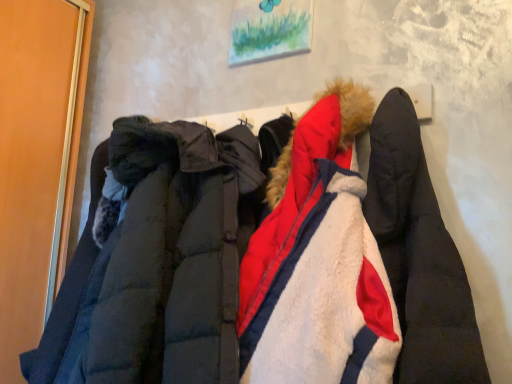
Where is `dark blue puffer jacket at center`? This screenshot has width=512, height=384. dark blue puffer jacket at center is located at coordinates (157, 263).

Measure the distance between dark blue puffer jacket at center and camera.

They are 31.39 inches apart.

Image resolution: width=512 pixels, height=384 pixels. What do you see at coordinates (157, 263) in the screenshot? I see `dark blue puffer jacket at center` at bounding box center [157, 263].

This screenshot has width=512, height=384. What are the coordinates of `dark blue puffer jacket at center` in the screenshot? It's located at (157, 263).